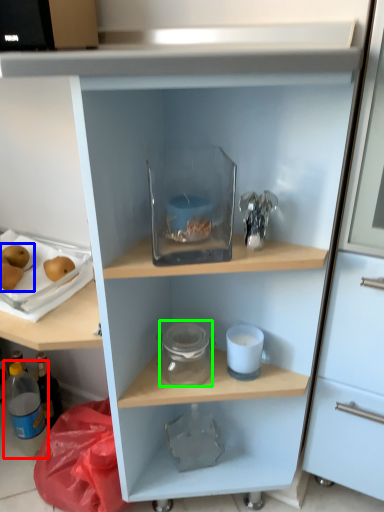
Question: Considering the real-world distances, which object is farthest from bottle (highlighted by a red box)? fruit (highlighted by a blue box) or glass jar (highlighted by a green box)?

Choices:
 (A) fruit
 (B) glass jar

Answer: (B)